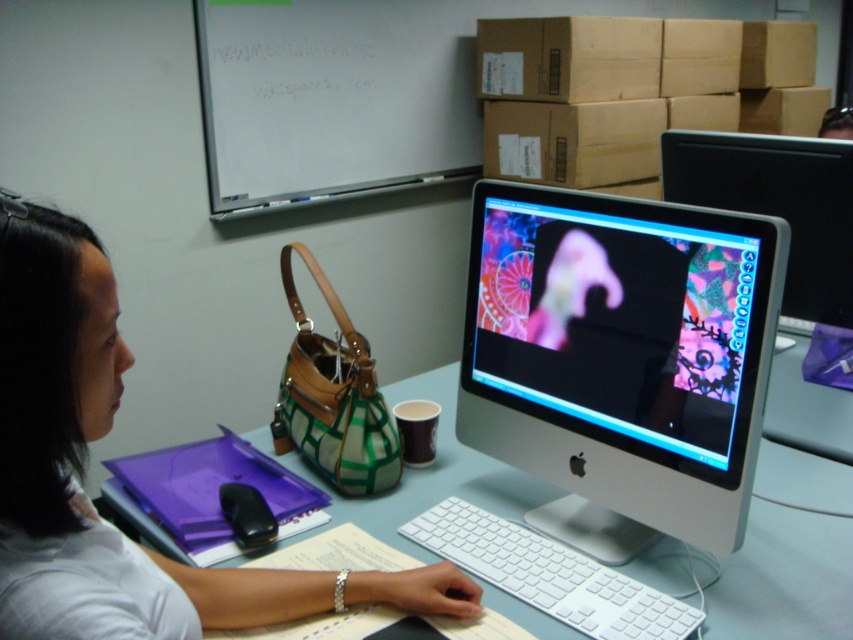
Is white fabric shirt at center below matte plastic monitor at upper right?

Yes, white fabric shirt at center is below matte plastic monitor at upper right.

Does white fabric shirt at center come in front of matte plastic monitor at upper right?

Yes, white fabric shirt at center is closer to the viewer.

Is point (77, 593) positioned behind point (749, 180)?

That is False.

Where is `white fabric shirt at center`? white fabric shirt at center is located at coordinates click(83, 470).

Can you confirm if whiteboard at upper center is bigger than white plastic keyboard at center?

Correct, whiteboard at upper center is larger in size than white plastic keyboard at center.

Is whiteboard at upper center positioned at the back of white plastic keyboard at center?

That is True.

Does point (218, 88) come farther from viewer compared to point (517, 572)?

Yes.

Image resolution: width=853 pixels, height=640 pixels. I want to click on whiteboard at upper center, so click(334, 97).

This screenshot has height=640, width=853. What do you see at coordinates (334, 97) in the screenshot?
I see `whiteboard at upper center` at bounding box center [334, 97].

Who is more forward, (299,22) or (242,541)?

Point (242,541) is more forward.

I want to click on whiteboard at upper center, so click(x=334, y=97).